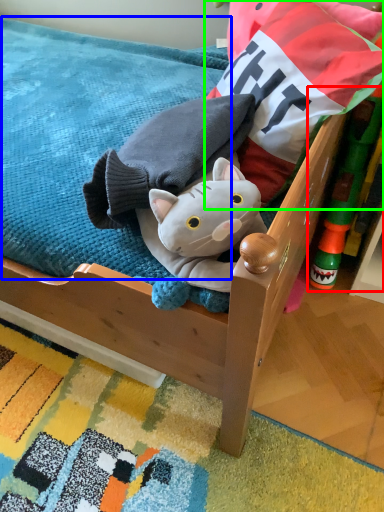
Question: Which object is positioned closest to toy (highlighted by a red box)? Select from mattress (highlighted by a blue box) and pillow (highlighted by a green box).

Choices:
 (A) mattress
 (B) pillow

Answer: (B)